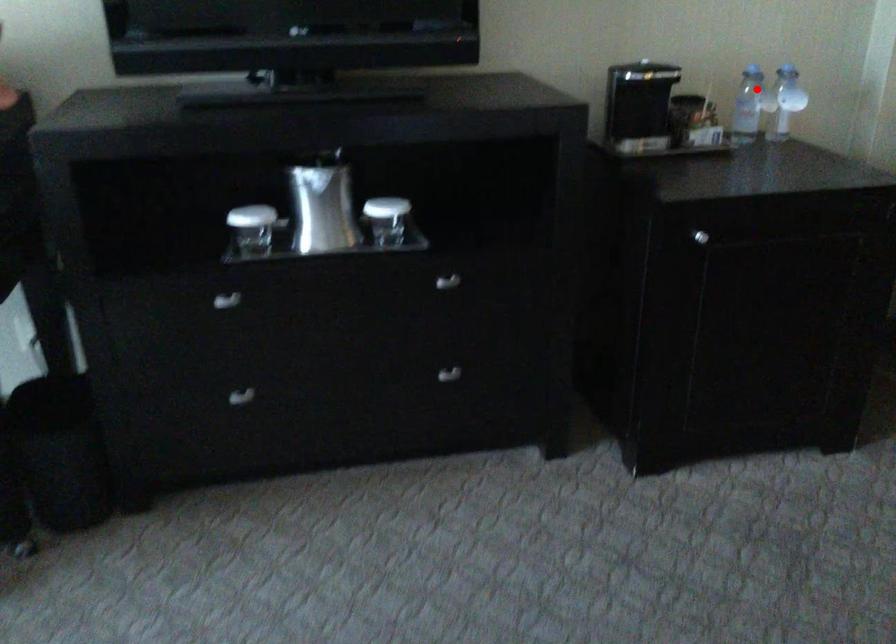
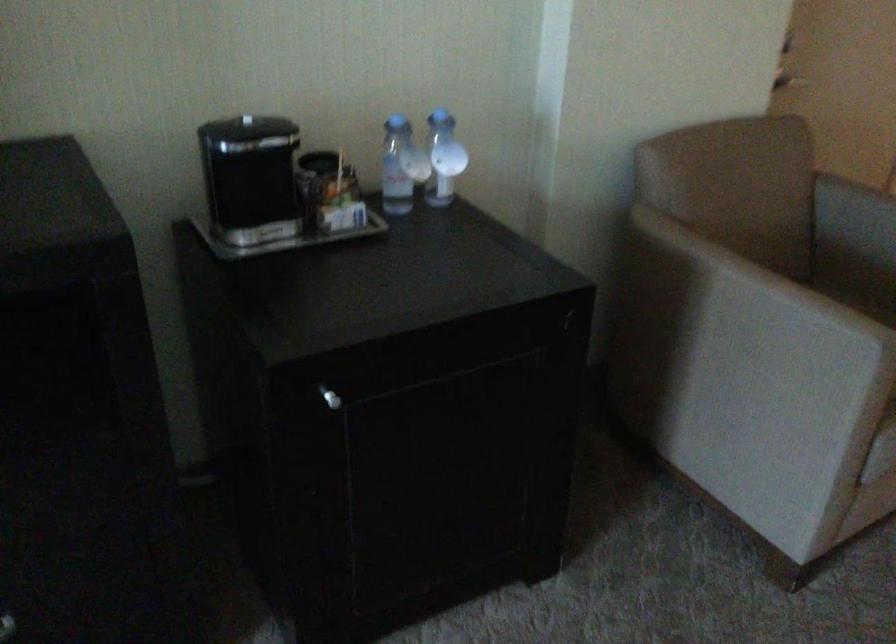
In the second image, find the point that corresponds to the highlighted location in the first image.

(401, 166)